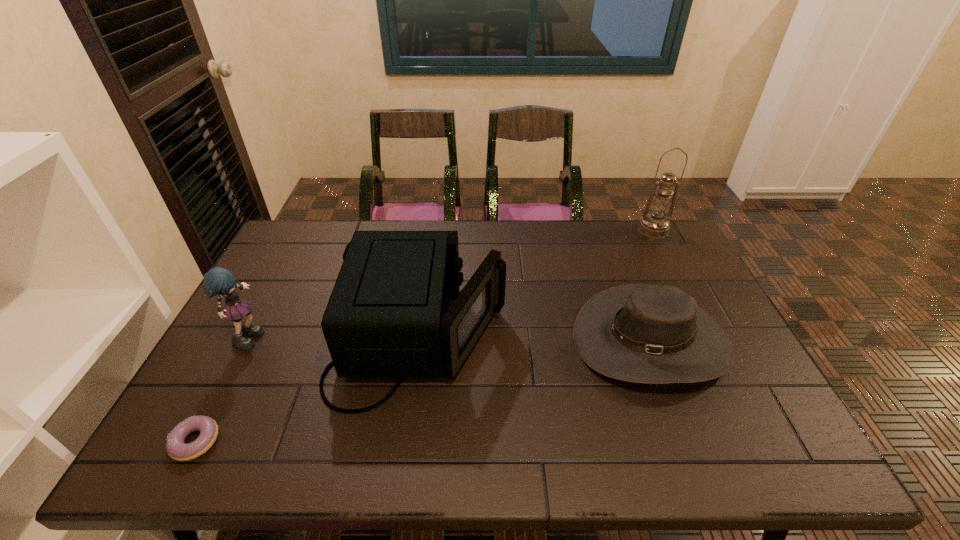
This screenshot has width=960, height=540. I want to click on oil lamp, so pos(655,225).

Find the location of a particular element. The width and height of the screenshot is (960, 540). the tallest object is located at coordinates (655, 225).

Where is `rag doll`? This screenshot has height=540, width=960. rag doll is located at coordinates (221, 281).

Locate an element on the screen. Image resolution: width=960 pixels, height=540 pixels. the third object from right to left is located at coordinates (389, 315).

This screenshot has width=960, height=540. Find the location of `the third shortest object`. the third shortest object is located at coordinates (389, 315).

Identify the location of the second shortest object. This screenshot has width=960, height=540. (640, 333).

The height and width of the screenshot is (540, 960). In order to click on doughnut in this screenshot , I will do `click(176, 448)`.

Locate an element on the screen. The width and height of the screenshot is (960, 540). the shortest object is located at coordinates (176, 448).

The image size is (960, 540). I want to click on vacant space located on the front of the tallest object, so click(x=686, y=295).

Where is `free point located 0.100m on the front-facing side of the rag doll`? free point located 0.100m on the front-facing side of the rag doll is located at coordinates (301, 335).